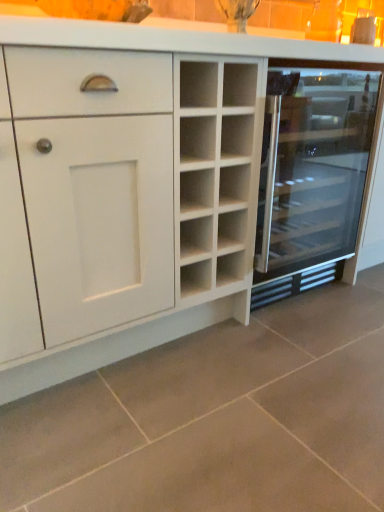
What is the approximate width of clear glass wine cooler at center?

24.56 inches.

Measure the distance between clear glass wine cooler at center and camera.

The distance of clear glass wine cooler at center from camera is 1.36 meters.

I want to click on clear glass wine cooler at center, so click(318, 173).

The image size is (384, 512). What do you see at coordinates (318, 173) in the screenshot? I see `clear glass wine cooler at center` at bounding box center [318, 173].

Locate an element on the screen. clear glass wine cooler at center is located at coordinates (318, 173).